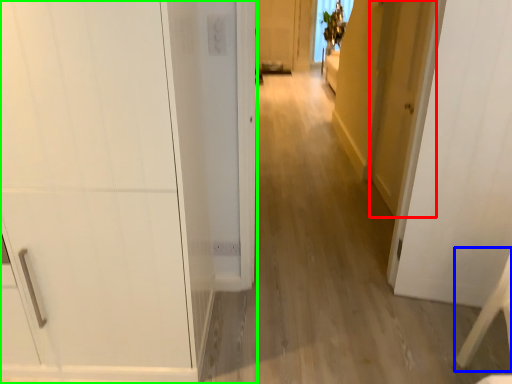
Question: Considering the real-world distances, which object is farthest from door (highlighted by a red box)? furniture (highlighted by a blue box) or door (highlighted by a green box)?

Choices:
 (A) furniture
 (B) door

Answer: (B)